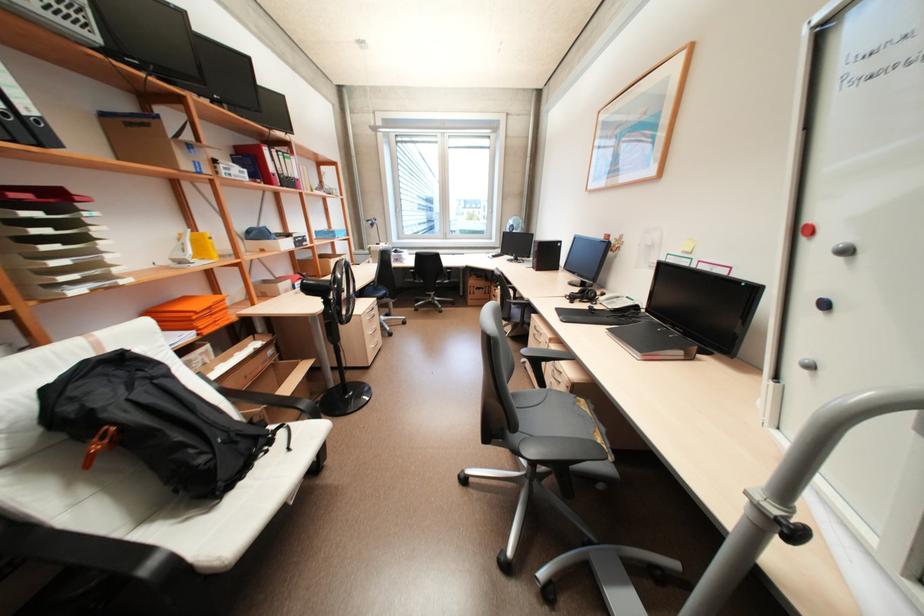
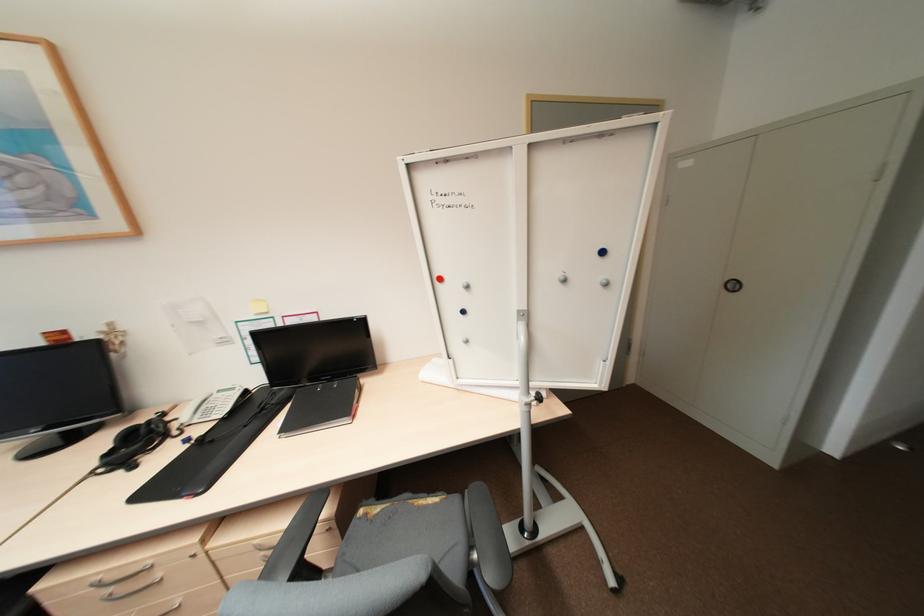
The point at (816, 367) is marked in the first image. Where is the corresponding point in the second image?

(472, 341)